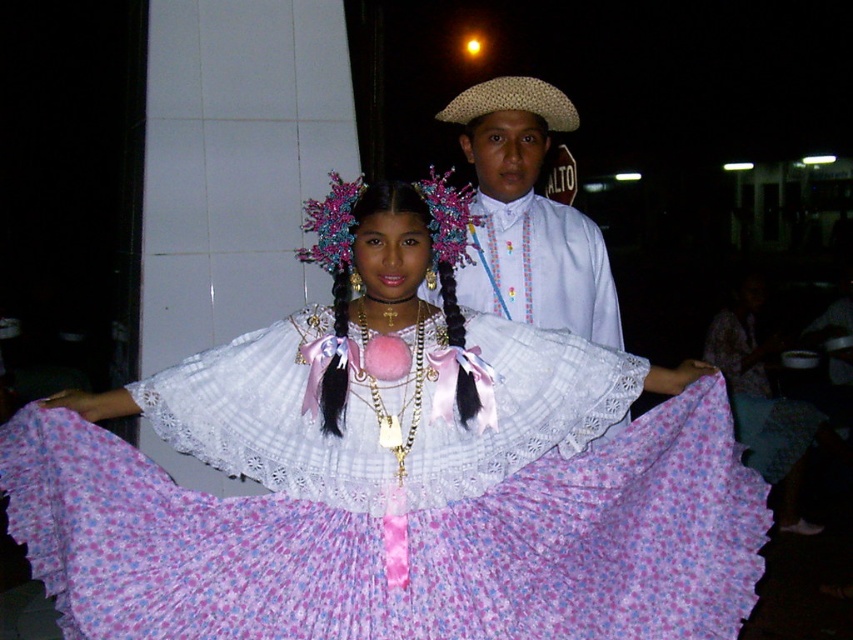
Between white woven hat at center and natural straw hat at center, which one is positioned higher?

natural straw hat at center is above.

Which of these two, white woven hat at center or natural straw hat at center, stands taller?

white woven hat at center

Locate an element on the screen. The image size is (853, 640). white woven hat at center is located at coordinates (527, 216).

Does white woven hat at center come behind pink fabric floral crown at center?

Yes.

Is white woven hat at center shorter than pink fabric floral crown at center?

Incorrect, white woven hat at center's height does not fall short of pink fabric floral crown at center's.

Which is behind, point (531, 228) or point (467, 394)?

Positioned behind is point (531, 228).

This screenshot has width=853, height=640. I want to click on white woven hat at center, so click(x=527, y=216).

What do you see at coordinates (393, 212) in the screenshot? I see `pink fabric floral crown at center` at bounding box center [393, 212].

Which is in front, point (341, 396) or point (544, 97)?

Point (341, 396) is more forward.

Where is `pink fabric floral crown at center`? This screenshot has height=640, width=853. pink fabric floral crown at center is located at coordinates (393, 212).